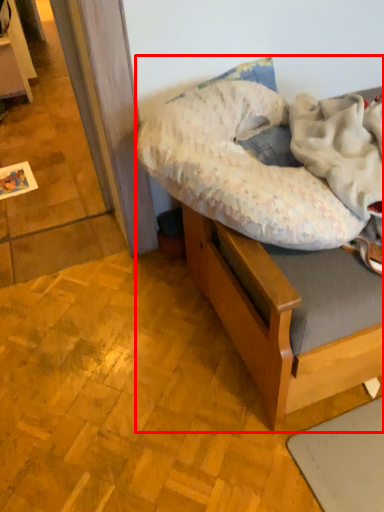
Question: Observing the image, what is the correct spatial positioning of hospital bed (annotated by the red box) in reference to pillow?

Choices:
 (A) right
 (B) left

Answer: (A)